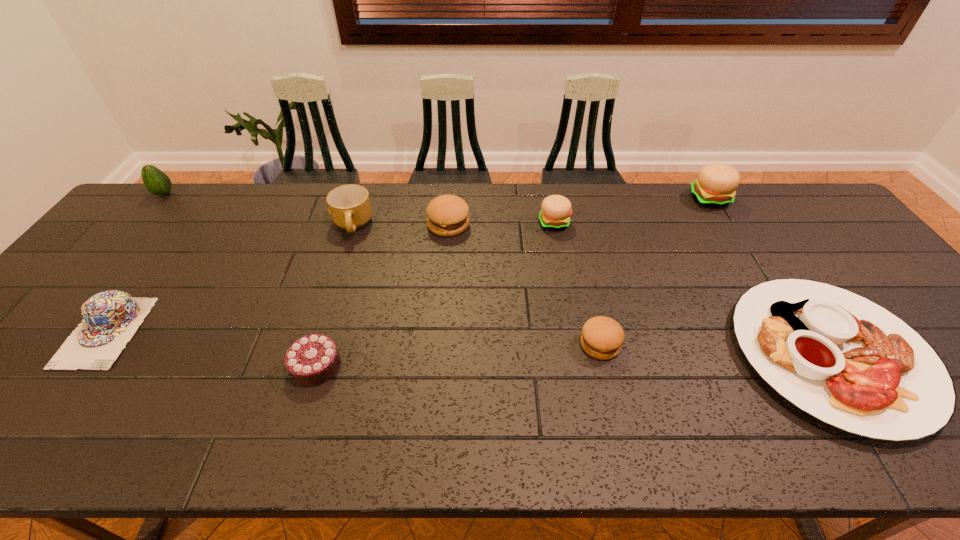
This screenshot has height=540, width=960. Identify the location of free spot that satisfies the following two spatial constraints: 1. on the back side of the shortest hamburger; 2. on the left side of the bigger beige hamburger. (566, 199).

Where is `free location that satisfies the following two spatial constraints: 1. on the front, side, and top of the chocolate cake; 2. on the left side of the eighth object from right to left`? free location that satisfies the following two spatial constraints: 1. on the front, side, and top of the chocolate cake; 2. on the left side of the eighth object from right to left is located at coordinates [x=81, y=366].

You are a GUI agent. You are given a task and a screenshot of the screen. Output one action in this format:
    pyautogui.click(x=<x>, y=<y>)
    Task: Click on the blank space that satisfies the following two spatial constraints: 1. on the front, side, and top of the eighth object from right to left; 2. on the right side of the right brown hamburger
    Image resolution: width=960 pixels, height=540 pixels.
    Given the screenshot: What is the action you would take?
    pyautogui.click(x=97, y=344)